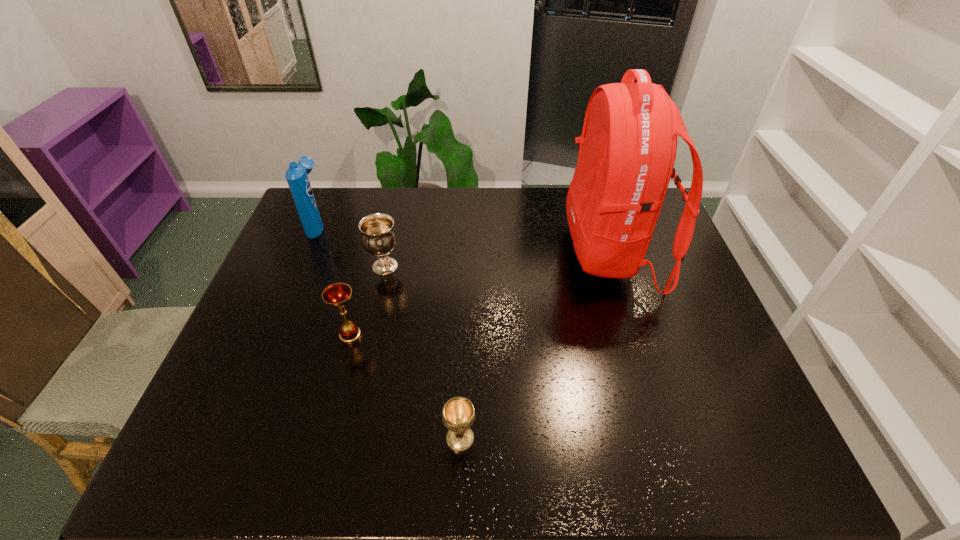
This screenshot has height=540, width=960. In order to click on object that is at the far left corner in this screenshot , I will do `click(296, 175)`.

Find the location of `object that is at the far right corner`. object that is at the far right corner is located at coordinates (628, 145).

At what (x,y) coordinates should I click in order to perform the action: click on free space at the far edge. Please return your answer as a coordinate pair (x, y). Looking at the image, I should click on (489, 200).

The width and height of the screenshot is (960, 540). What are the coordinates of `vacant space at the near edge` in the screenshot? It's located at (674, 468).

The width and height of the screenshot is (960, 540). I want to click on free point at the left edge, so click(x=295, y=301).

I want to click on blank space at the right edge of the desktop, so click(x=654, y=233).

What are the coordinates of `free space between the farthest chalice and the leftmost object` in the screenshot? It's located at (351, 246).

Identify the location of free space between the farthest chalice and the second nearest object. (368, 301).

What are the coordinates of `empty space that is in between the nearest chalice and the second tallest object` in the screenshot? It's located at (389, 332).

The height and width of the screenshot is (540, 960). Identify the location of vacant area that lies between the farthest chalice and the tallest object. (498, 260).